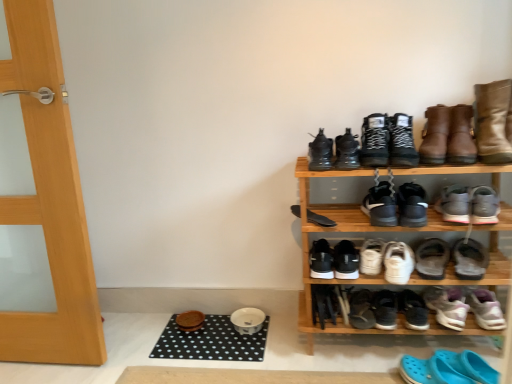
Find the location of a particular element. Image resolution: width=512 pixels, height=384 pixels. vacant space in between black rubber doormat at lower center, which is the 2th doormat from back to front, and black dotted mat at lower center, the first doormat in the back-to-front sequence is located at coordinates (287, 350).